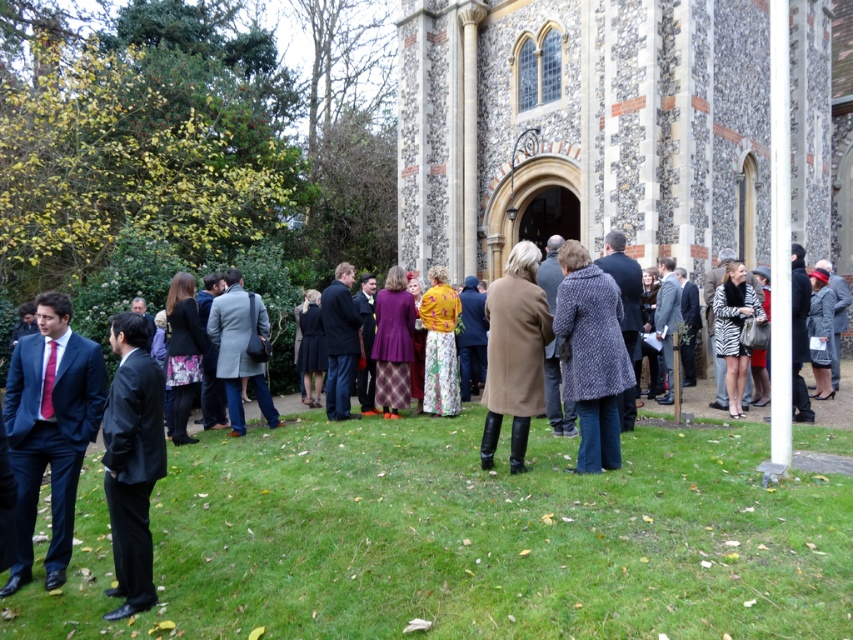
Is light gray wool coat at center positioned before floral fabric dress at center?

Yes.

Between point (231, 291) and point (448, 291), which one is positioned in front?

Point (231, 291) is in front.

This screenshot has height=640, width=853. I want to click on light gray wool coat at center, so click(239, 349).

Is point (560, 264) in front of point (531, 252)?

No, it is behind (531, 252).

The image size is (853, 640). Describe the element at coordinates (590, 355) in the screenshot. I see `patterned wool coat at center` at that location.

In order to click on patterned wool coat at center in this screenshot , I will do `click(590, 355)`.

Can you confirm if dark blue suit at lower left is wider than matte brown coat at center?

Indeed, dark blue suit at lower left has a greater width compared to matte brown coat at center.

What do you see at coordinates (50, 429) in the screenshot?
I see `dark blue suit at lower left` at bounding box center [50, 429].

The width and height of the screenshot is (853, 640). Identify the location of dark blue suit at lower left. (50, 429).

At what (x,y) coordinates should I click in order to perform the action: click on dark blue suit at lower left. Please return your answer as a coordinate pair (x, y). The width and height of the screenshot is (853, 640). Looking at the image, I should click on (50, 429).